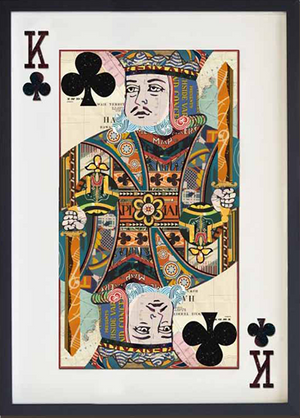
Where is `frame`? The width and height of the screenshot is (300, 418). frame is located at coordinates (294, 281).